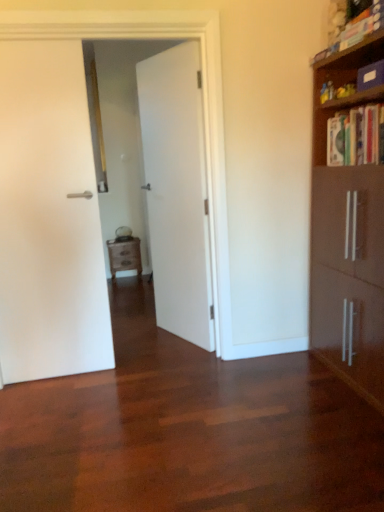
Question: Considering the relative sizes of hardcover book at upper right, arranged as the second book when viewed from the top, and wooden nightstand at center in the image provided, is hardcover book at upper right, arranged as the second book when viewed from the top, smaller than wooden nightstand at center?

Choices:
 (A) no
 (B) yes

Answer: (A)

Question: Are hardcover book at upper right, arranged as the second book when viewed from the top, and wooden nightstand at center located far from each other?

Choices:
 (A) yes
 (B) no

Answer: (A)

Question: Considering the relative sizes of hardcover book at upper right, arranged as the second book when viewed from the top, and wooden nightstand at center in the image provided, is hardcover book at upper right, arranged as the second book when viewed from the top, taller than wooden nightstand at center?

Choices:
 (A) no
 (B) yes

Answer: (A)

Question: Does hardcover book at upper right, the first book positioned from the bottom, come behind wooden nightstand at center?

Choices:
 (A) yes
 (B) no

Answer: (B)

Question: Does hardcover book at upper right, arranged as the second book when viewed from the top, touch wooden nightstand at center?

Choices:
 (A) no
 (B) yes

Answer: (A)

Question: Does hardcover book at upper right, arranged as the second book when viewed from the top, have a greater width compared to wooden nightstand at center?

Choices:
 (A) no
 (B) yes

Answer: (B)

Question: Is white matte door at left, which appears as the second door when viewed from the right, thinner than wooden nightstand at center?

Choices:
 (A) no
 (B) yes

Answer: (B)

Question: From a real-world perspective, is white matte door at left, arranged as the first door when viewed from the left, physically below wooden nightstand at center?

Choices:
 (A) no
 (B) yes

Answer: (A)

Question: Is white matte door at left, which appears as the second door when viewed from the right, beside wooden nightstand at center?

Choices:
 (A) no
 (B) yes

Answer: (A)

Question: Is white matte door at left, arranged as the first door when viewed from the left, outside wooden nightstand at center?

Choices:
 (A) yes
 (B) no

Answer: (A)

Question: From the image's perspective, is white matte door at left, arranged as the first door when viewed from the left, under wooden nightstand at center?

Choices:
 (A) yes
 (B) no

Answer: (B)

Question: Is white matte door at left, which appears as the second door when viewed from the right, taller than wooden nightstand at center?

Choices:
 (A) no
 (B) yes

Answer: (B)

Question: Can you confirm if wooden nightstand at center is thinner than white matte door at center, the 2th door positioned from the left?

Choices:
 (A) yes
 (B) no

Answer: (B)